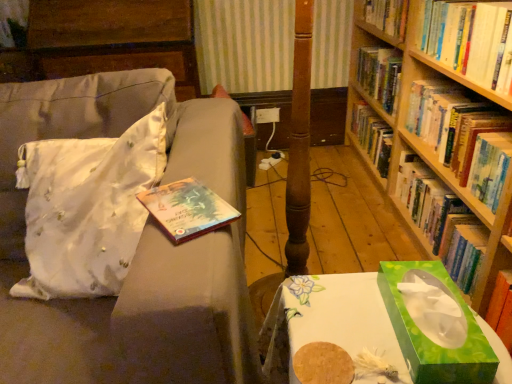
Question: Is hardcover book at upper right, which is the third book in bottom-to-top order, located outside white satin throw pillow at left?

Choices:
 (A) no
 (B) yes

Answer: (B)

Question: Can you confirm if hardcover book at upper right, the first book viewed from the top, is thinner than white satin throw pillow at left?

Choices:
 (A) no
 (B) yes

Answer: (B)

Question: Does hardcover book at upper right, the first book viewed from the top, have a lesser height compared to white satin throw pillow at left?

Choices:
 (A) yes
 (B) no

Answer: (A)

Question: Does hardcover book at upper right, the first book viewed from the top, have a greater width compared to white satin throw pillow at left?

Choices:
 (A) yes
 (B) no

Answer: (B)

Question: Is hardcover book at upper right, the first book viewed from the top, positioned in front of white satin throw pillow at left?

Choices:
 (A) yes
 (B) no

Answer: (B)

Question: Looking at the image, does hardcover book at right, acting as the second book starting from the top, seem bigger or smaller compared to green paper tissue box at lower right?

Choices:
 (A) big
 (B) small

Answer: (A)

Question: Is point (482, 124) closer or farther from the camera than point (458, 291)?

Choices:
 (A) farther
 (B) closer

Answer: (A)

Question: Looking at their shapes, would you say hardcover book at right, acting as the second book starting from the top, is wider or thinner than green paper tissue box at lower right?

Choices:
 (A) wide
 (B) thin

Answer: (B)

Question: From the image's perspective, is hardcover book at right, marked as the 2th book in a bottom-to-top arrangement, located above or below green paper tissue box at lower right?

Choices:
 (A) below
 (B) above

Answer: (B)

Question: Would you say hardcover book at right, acting as the second book starting from the top, is inside or outside hardcover book at upper right, acting as the 1th book starting from the bottom?

Choices:
 (A) outside
 (B) inside

Answer: (A)

Question: Relative to hardcover book at upper right, marked as the 3th book in a top-to-bottom arrangement, is hardcover book at right, acting as the second book starting from the top, in front or behind?

Choices:
 (A) behind
 (B) front

Answer: (B)

Question: Would you say hardcover book at right, marked as the 2th book in a bottom-to-top arrangement, is to the left or to the right of hardcover book at upper right, acting as the 1th book starting from the bottom, in the picture?

Choices:
 (A) left
 (B) right

Answer: (A)

Question: Looking at their shapes, would you say hardcover book at right, acting as the second book starting from the top, is wider or thinner than hardcover book at upper right, marked as the 3th book in a top-to-bottom arrangement?

Choices:
 (A) wide
 (B) thin

Answer: (B)

Question: Considering the positions of hardcover book at upper right, acting as the 1th book starting from the bottom, and green paper tissue box at lower right in the image, is hardcover book at upper right, acting as the 1th book starting from the bottom, taller or shorter than green paper tissue box at lower right?

Choices:
 (A) short
 (B) tall

Answer: (B)

Question: In the image, is hardcover book at upper right, marked as the 3th book in a top-to-bottom arrangement, on the left side or the right side of green paper tissue box at lower right?

Choices:
 (A) left
 (B) right

Answer: (B)